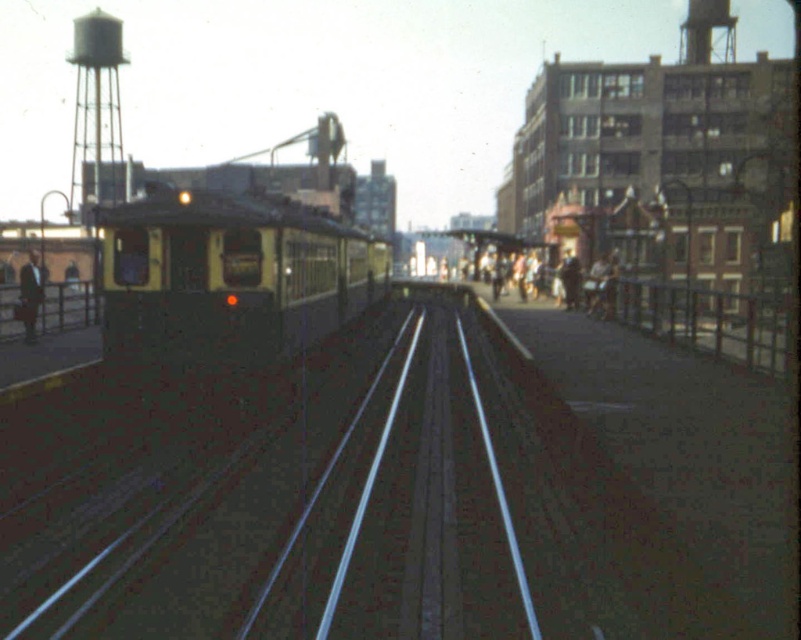
You are standing at point [91,176] and want to walk to point [504,621]. Based on the railway tracks and platform layout, will you need to cross the tracks to reach your destination?

Yes, you will need to cross the tracks because point [504,621] is in front of point [91,176] along the tracks, meaning they are on opposite sides.

You are a photographer standing at the center of the railway tracks. You want to take a photo of both the white painted metal water tower at upper left and the matte black suit at left. Which object should you zoom in on to capture more details of its features?

The white painted metal water tower at upper left has a larger size compared to the matte black suit at left, so you should zoom in on the matte black suit at left to capture more details of its features.

You are standing on the platform and want to walk from point A to point B. Point A is at coordinate point(101, 44) and point B is at coordinate point(29, 296). Which point is closer to you when you start at point A?

Point A is closer to you initially because you are starting there, but the question asks which is closer when starting at point A. Wait, the description says point0.070,0.127 is further to the viewer than point0.464,0.037. Hmm, maybe I need to rephrase. Since point A is further away from the viewer, point B is closer to the viewer. So the answer should be point B is closer to the viewer.